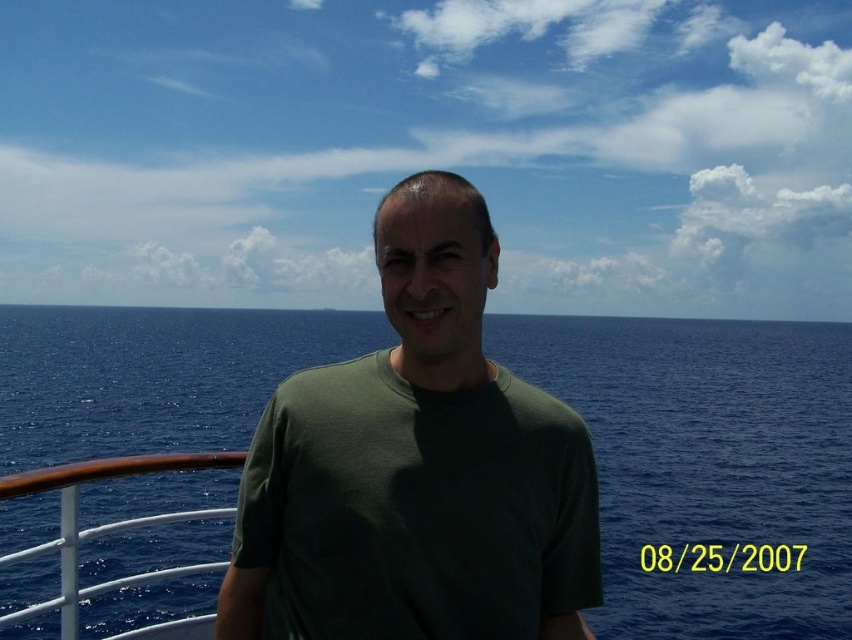
Question: Among these points, which one is farthest from the camera?

Choices:
 (A) (234, 406)
 (B) (468, 561)

Answer: (A)

Question: Is blue water at center positioned in front of dark green t-shirt at center?

Choices:
 (A) no
 (B) yes

Answer: (A)

Question: Can you confirm if blue water at center is positioned below dark green t-shirt at center?

Choices:
 (A) yes
 (B) no

Answer: (A)

Question: Does blue water at center appear on the right side of dark green t-shirt at center?

Choices:
 (A) no
 (B) yes

Answer: (B)

Question: Which point is closer to the camera?

Choices:
 (A) (39, 506)
 (B) (324, 390)

Answer: (B)

Question: Which point is farther from the camera taking this photo?

Choices:
 (A) (122, 576)
 (B) (453, 216)

Answer: (A)